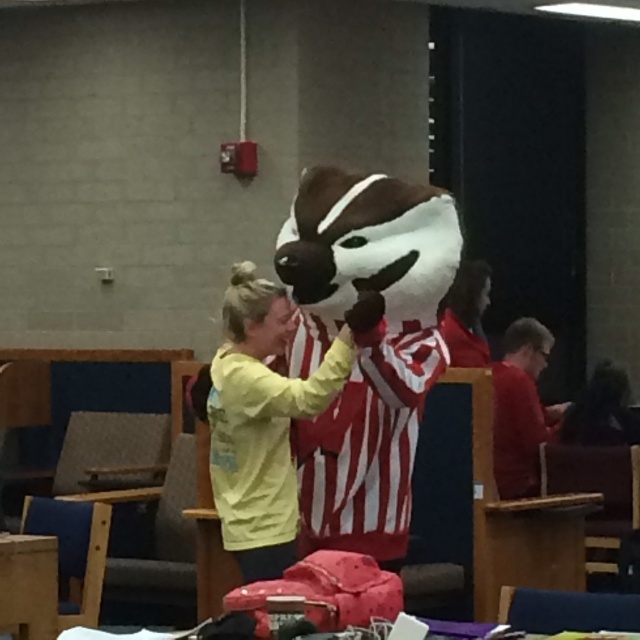
Question: Which of these objects is positioned closest to the smooth red shirt at center?

Choices:
 (A) red matte shirt at right
 (B) yellow cotton shirt at center

Answer: (A)

Question: Which point is farther to the camera?

Choices:
 (A) (472, 342)
 (B) (540, 365)
 (C) (243, 576)

Answer: (B)

Question: Can you confirm if red matte shirt at right is positioned below smooth red shirt at center?

Choices:
 (A) no
 (B) yes

Answer: (B)

Question: Where is yellow cotton shirt at center located in relation to smooth red shirt at center in the image?

Choices:
 (A) left
 (B) right

Answer: (A)

Question: From the image, what is the correct spatial relationship of yellow cotton shirt at center in relation to smooth red shirt at center?

Choices:
 (A) above
 (B) below

Answer: (B)

Question: Which object is the closest to the red matte shirt at right?

Choices:
 (A) smooth red shirt at center
 (B) yellow cotton shirt at center

Answer: (A)